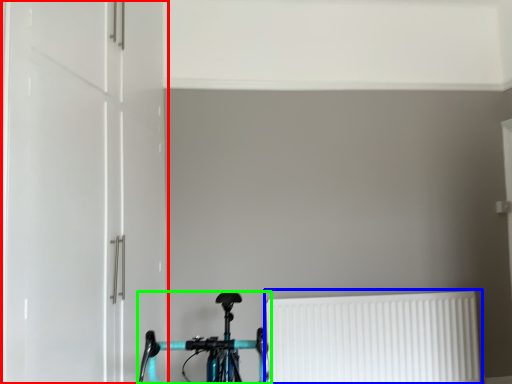
Question: Based on their relative distances, which object is nearer to door (highlighted by a red box)? Choose from radiator (highlighted by a blue box) and bicycle (highlighted by a green box).

Choices:
 (A) radiator
 (B) bicycle

Answer: (B)